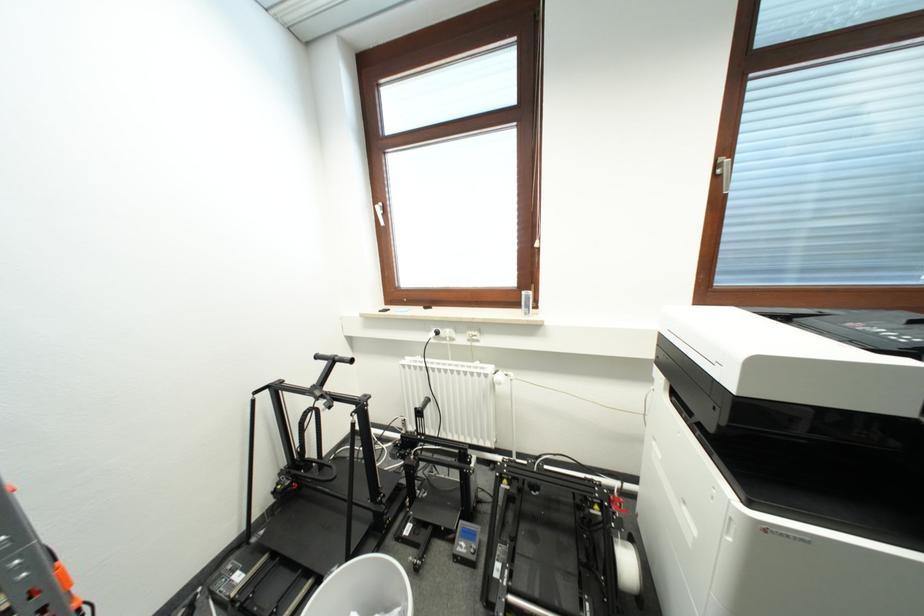
You are a GUI agent. You are given a task and a screenshot of the screen. Output one action in this format:
    pyautogui.click(x=<x>, y=<y>)
    Task: Click on the white window handle
    
    Given the screenshot: What is the action you would take?
    pyautogui.click(x=380, y=213)